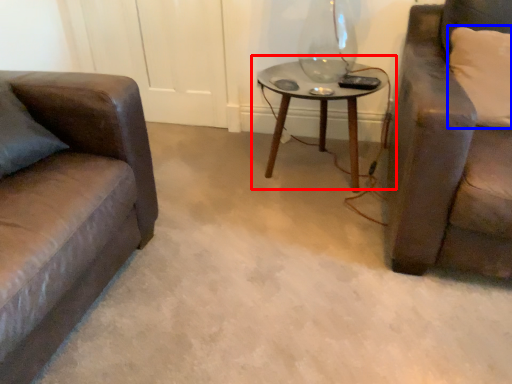
Question: Which object is further to the camera taking this photo, table (highlighted by a red box) or pillow (highlighted by a blue box)?

Choices:
 (A) table
 (B) pillow

Answer: (A)